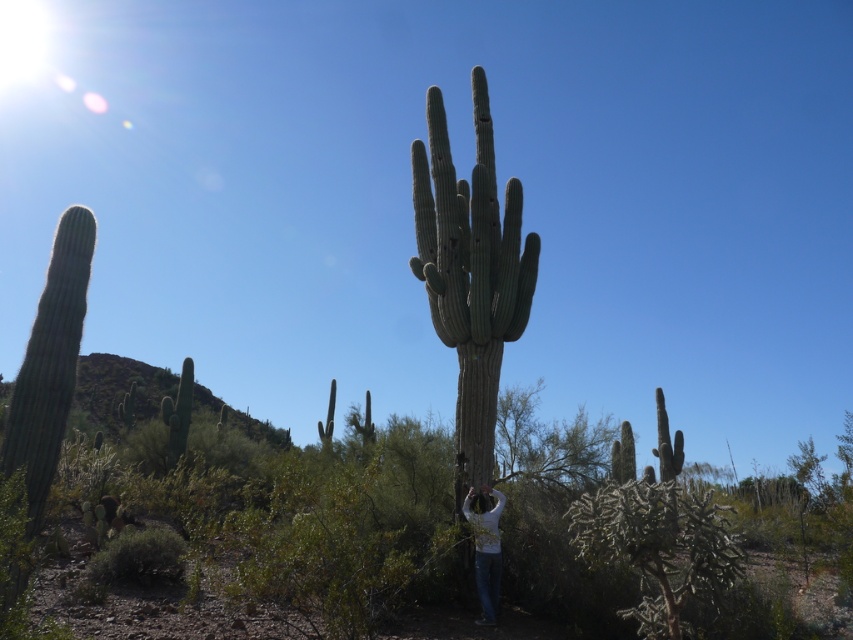
You are standing in the desert scene and want to know if the green spiny cactus at center is wider than the white matte shirt at center. Based on the description, can you determine which object is wider?

The green spiny cactus at center is wider than the white matte shirt at center according to the description.

You are standing at the point with coordinates point (469,273) in the desert scene. What object is located exactly at your current position?

The green spiny cactus at center is located exactly at point (469,273).